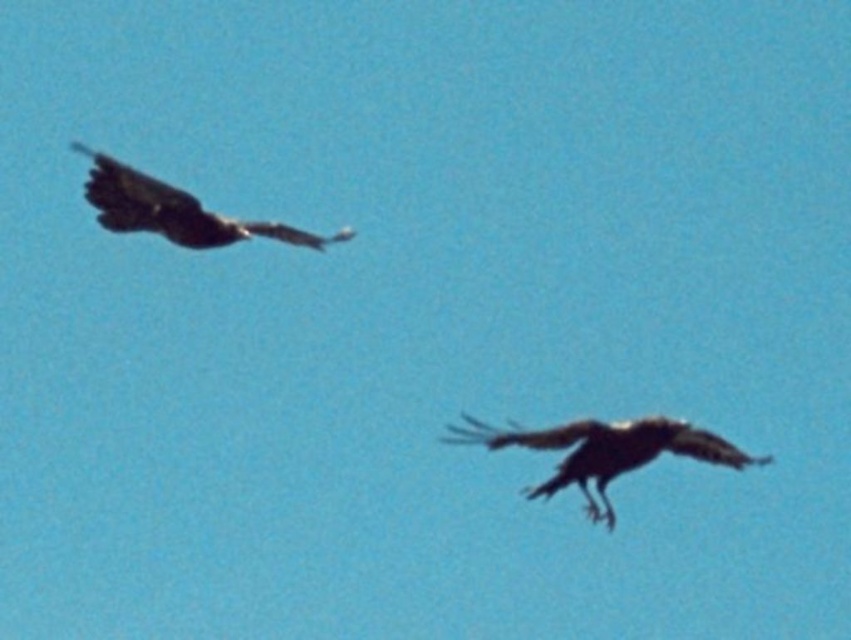
Is shiny black eagle at lower center above dark brown feathers at upper left?

No.

Which of these two, shiny black eagle at lower center or dark brown feathers at upper left, stands taller?

With more height is shiny black eagle at lower center.

Locate an element on the screen. shiny black eagle at lower center is located at coordinates click(x=606, y=451).

This screenshot has width=851, height=640. In order to click on shiny black eagle at lower center in this screenshot , I will do `click(606, 451)`.